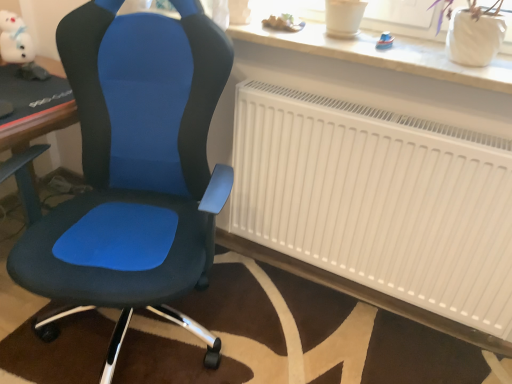
Locate an element on the screen. The width and height of the screenshot is (512, 384). free space below matte blue fabric chair at center (from a real-world perspective) is located at coordinates [136, 341].